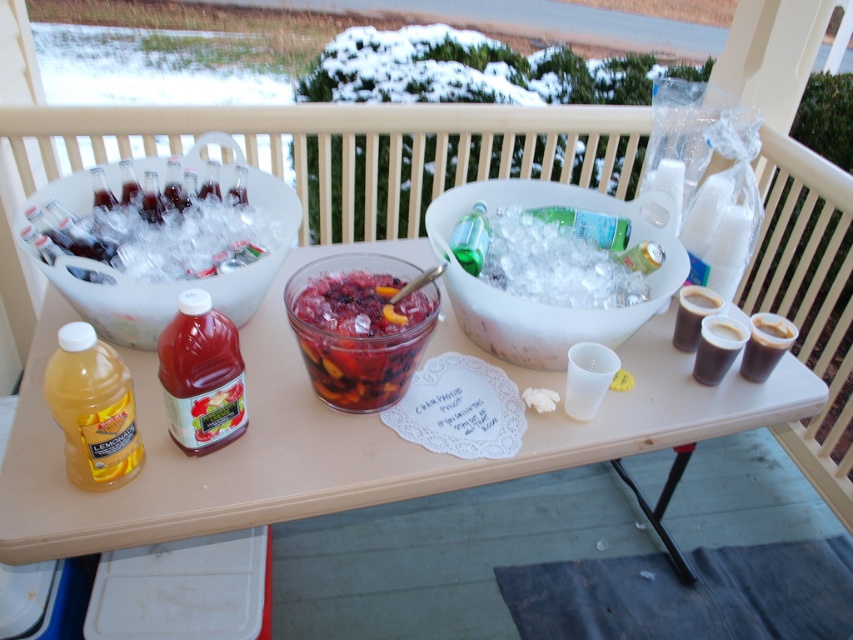
Question: Is red matte plastic bottle at lower left smaller than green glass bottle at center?

Choices:
 (A) no
 (B) yes

Answer: (A)

Question: Can you confirm if yellow translucent plastic bottle at lower left is positioned below black matte cup at right?

Choices:
 (A) yes
 (B) no

Answer: (A)

Question: Which point appears farthest from the camera in this image?

Choices:
 (A) (618, 244)
 (B) (769, 368)

Answer: (A)

Question: Which of the following is the closest to the observer?

Choices:
 (A) clear plastic ice at center
 (B) green glass bottle at center
 (C) black matte cup at right
 (D) dark brown glass at right

Answer: (C)

Question: Among these points, which one is nearest to the camera?

Choices:
 (A) (786, 332)
 (B) (339, 356)
 (C) (694, 296)

Answer: (B)

Question: Can you confirm if translucent glass punch bowl at center is bigger than red matte plastic bottle at lower left?

Choices:
 (A) no
 (B) yes

Answer: (B)